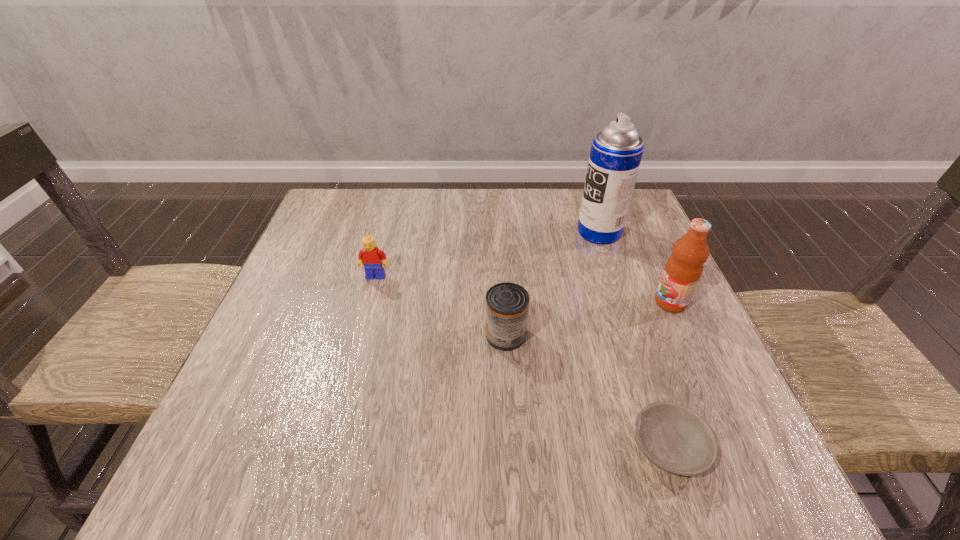
Locate an element on the screen. free point at the far left corner is located at coordinates (351, 198).

Identify the location of vacant area at the far right corner. This screenshot has height=540, width=960. (648, 234).

Where is `vacant space at the near right corner of the desktop`? The height and width of the screenshot is (540, 960). vacant space at the near right corner of the desktop is located at coordinates (677, 493).

The height and width of the screenshot is (540, 960). I want to click on vacant area that lies between the fourth nearest object and the fourth object from right to left, so click(x=441, y=306).

Where is `free space that is in between the farthest object and the fruit juice`? This screenshot has height=540, width=960. free space that is in between the farthest object and the fruit juice is located at coordinates (635, 267).

The image size is (960, 540). I want to click on vacant space that's between the fourth object from right to left and the aerosol can, so click(x=552, y=284).

You are a GUI agent. You are given a task and a screenshot of the screen. Output one action in this format:
    pyautogui.click(x=<x>, y=<y>)
    Task: Click on the vacant area that lies between the fourth object from right to left and the Lego
    
    Given the screenshot: What is the action you would take?
    pyautogui.click(x=441, y=306)

Find the location of a particular element. vacant space that is in between the second nearest object and the nearest object is located at coordinates (588, 391).

Where is `vacant area between the shortest object and the can`? The height and width of the screenshot is (540, 960). vacant area between the shortest object and the can is located at coordinates (588, 391).

The width and height of the screenshot is (960, 540). Find the location of `unoccupied position between the rightmost object and the aerosol can`. unoccupied position between the rightmost object and the aerosol can is located at coordinates (635, 267).